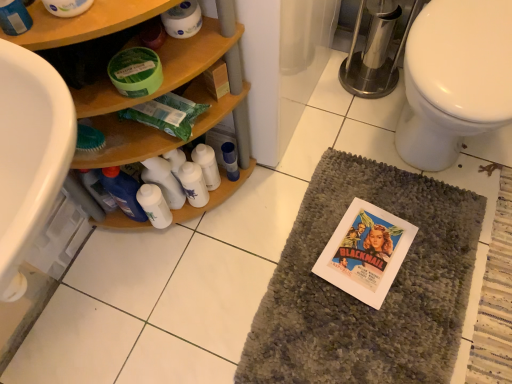
Locate an element on the screen. The image size is (512, 384). free space on the front side of white glossy toilet at right is located at coordinates (437, 283).